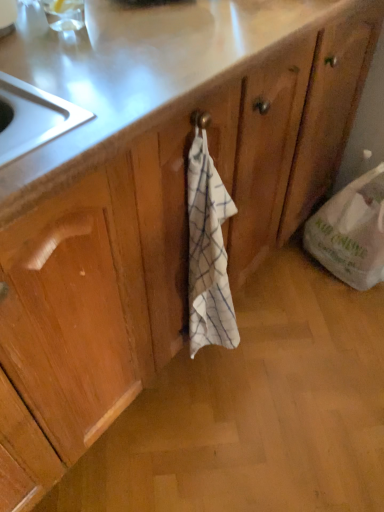
Locate an element on the screen. The image size is (384, 512). vacant space in front of white plastic bag at lower right is located at coordinates (341, 310).